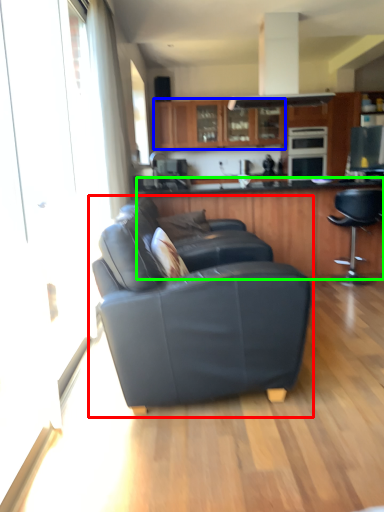
Question: Considering the real-world distances, which object is closest to studio couch (highlighted by a red box)? cabinetry (highlighted by a blue box) or cabinetry (highlighted by a green box).

Choices:
 (A) cabinetry
 (B) cabinetry

Answer: (B)